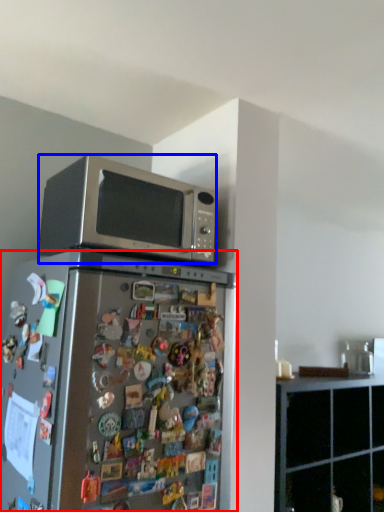
Question: Which point is closer to the camera, refrigerator (highlighted by a red box) or microwave oven (highlighted by a blue box)?

Choices:
 (A) refrigerator
 (B) microwave oven

Answer: (A)